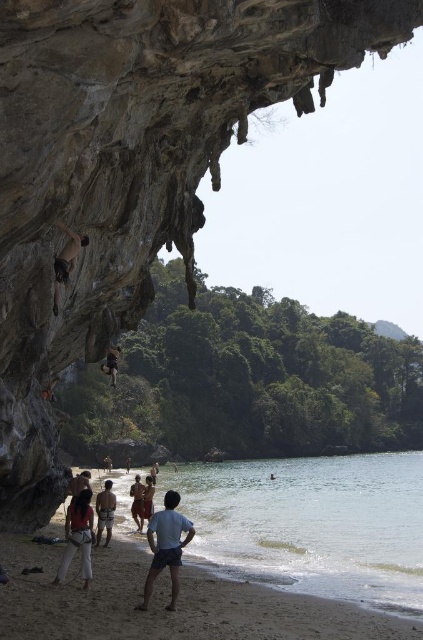
Does light blue shorts at lower center have a lesser width compared to matte red shorts at lower left?

Yes.

Looking at this image, who is positioned more to the right, light blue shorts at lower center or matte red shorts at lower left?

light blue shorts at lower center is more to the right.

Who is more forward, (153, 556) or (84, 493)?

Positioned in front is point (153, 556).

This screenshot has width=423, height=640. I want to click on light blue shorts at lower center, so click(165, 547).

Does point (192, 632) come behind point (88, 529)?

No, (192, 632) is closer to viewer.

At what (x,y) coordinates should I click in order to perform the action: click on smooth sand beach at lower center. Please return your answer as a coordinate pair (x, y). Looking at the image, I should click on (165, 602).

The height and width of the screenshot is (640, 423). I want to click on smooth sand beach at lower center, so click(x=165, y=602).

Does point (392, 534) lie behind point (197, 627)?

Yes.

Locate an element on the screen. clear water at lower center is located at coordinates (310, 524).